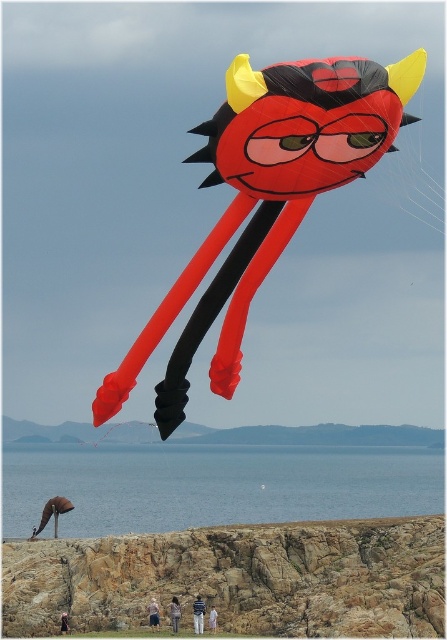
You are standing on the rocky shoreline and looking up at the sky. You see a matte plastic kite at upper center and a light brown hair at lower center. Which object is bigger in size?

The matte plastic kite at upper center is larger in size compared to the light brown hair at lower center.

You are standing on the rocky shoreline and see the matte plastic kite at upper center and the light brown hair at lower center. How far apart are these two objects from your current position?

The matte plastic kite at upper center is 47.36 meters away from the light brown hair at lower center.